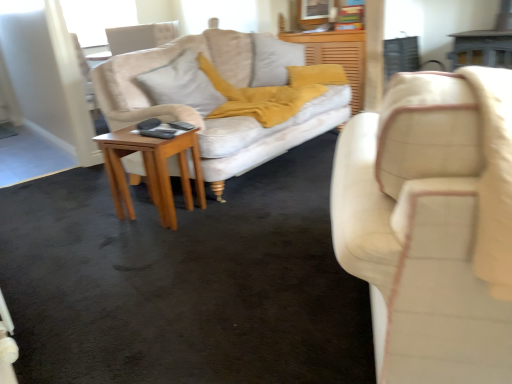
I want to click on vacant region below light brown wooden side table at center (from a real-world perspective), so click(157, 216).